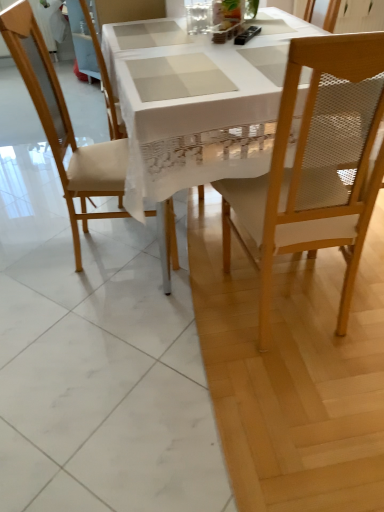
Where is `vacant region under light wood mesh chair at right, placed as the 3th chair when sorted from left to right (from a real-world perspective)`? This screenshot has width=384, height=512. vacant region under light wood mesh chair at right, placed as the 3th chair when sorted from left to right (from a real-world perspective) is located at coordinates (292, 313).